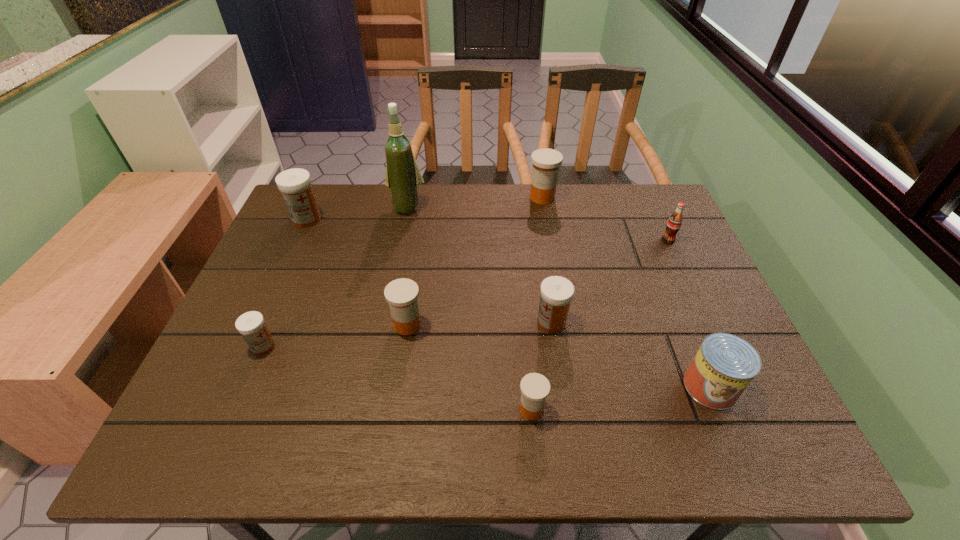
Find the location of `blank area in the image that satisfies the following two spatial constraints: 1. on the label of the biggest orange medicine; 2. on the label of the second biggest orange medicine`. blank area in the image that satisfies the following two spatial constraints: 1. on the label of the biggest orange medicine; 2. on the label of the second biggest orange medicine is located at coordinates (564, 325).

What are the coordinates of `vacant area in the image that satisfies the following two spatial constraints: 1. on the label of the fourth farthest object; 2. on the left side of the farthest medicine` in the screenshot? It's located at (549, 240).